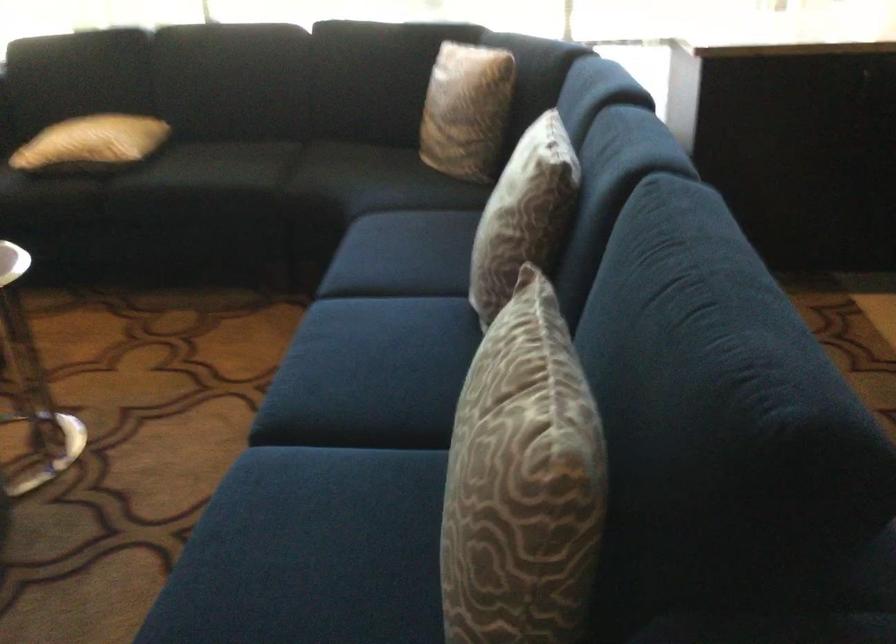
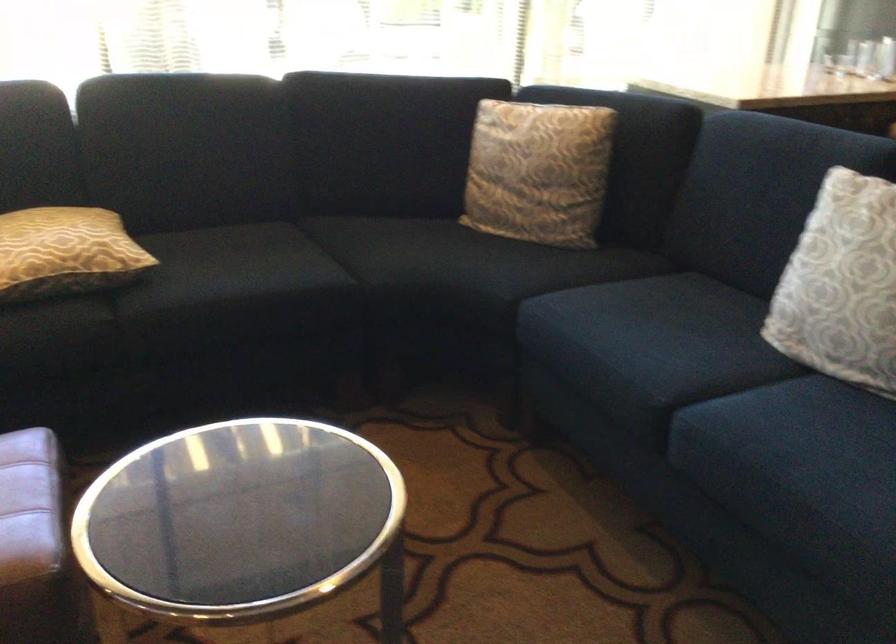
In the second image, find the point that corresponds to [319,176] in the first image.

(391, 261)